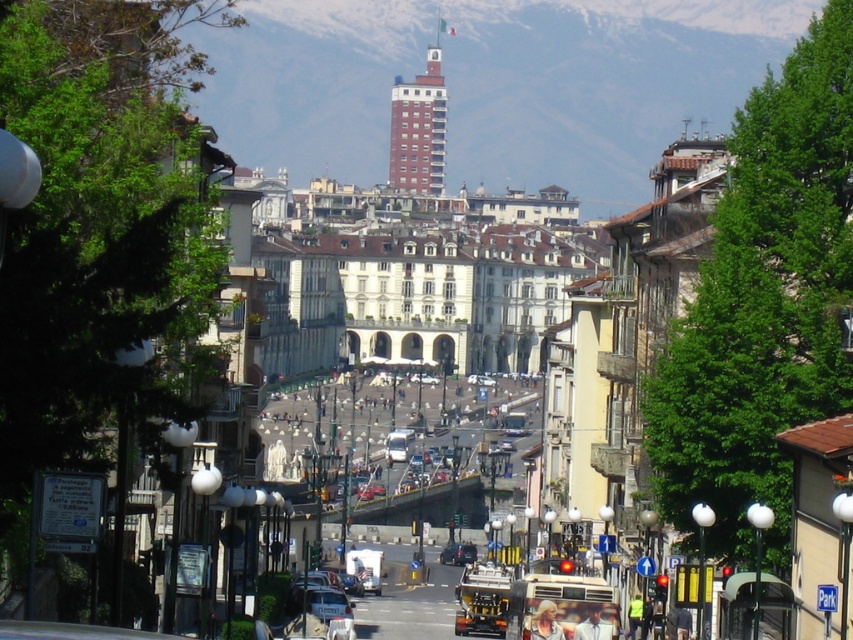
Question: Which point appears farthest from the camera in this image?

Choices:
 (A) (550, 609)
 (B) (450, 561)

Answer: (B)

Question: Which of the following is the farthest from the observer?

Choices:
 (A) (592, 605)
 (B) (440, 554)
 (C) (548, 634)

Answer: (B)

Question: Is white snow-covered mountain at upper center to the right of light brown hair at center from the viewer's perspective?

Choices:
 (A) no
 (B) yes

Answer: (B)

Question: Does red brick tower at upper center appear under metallic silver car at center?

Choices:
 (A) no
 (B) yes

Answer: (A)

Question: Does white snow-covered mountain at upper center appear over metallic silver car at center?

Choices:
 (A) yes
 (B) no

Answer: (A)

Question: Which object is closer to the camera taking this photo?

Choices:
 (A) light brown leather jacket at center
 (B) white snow-covered mountain at upper center
 (C) metallic silver car at center

Answer: (A)